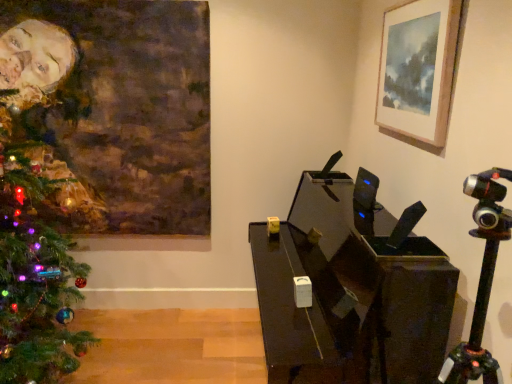
Question: Does green matte christmas tree at left contain wooden picture frame at upper right, the 2th picture frame positioned from the left?

Choices:
 (A) no
 (B) yes

Answer: (A)

Question: From the image's perspective, is green matte christmas tree at left beneath wooden picture frame at upper right, marked as the 1th picture frame in a front-to-back arrangement?

Choices:
 (A) yes
 (B) no

Answer: (A)

Question: Is green matte christmas tree at left thinner than wooden picture frame at upper right, the 2th picture frame positioned from the left?

Choices:
 (A) no
 (B) yes

Answer: (A)

Question: Can we say green matte christmas tree at left lies outside wooden picture frame at upper right, positioned as the first picture frame in right-to-left order?

Choices:
 (A) no
 (B) yes

Answer: (B)

Question: Can you confirm if green matte christmas tree at left is wider than wooden picture frame at upper right, positioned as the first picture frame in right-to-left order?

Choices:
 (A) yes
 (B) no

Answer: (A)

Question: Is green matte christmas tree at left smaller than wooden picture frame at upper right, marked as the 1th picture frame in a front-to-back arrangement?

Choices:
 (A) no
 (B) yes

Answer: (A)

Question: Does oil painting portrait at left, acting as the 1th picture frame starting from the left, turn towards green matte christmas tree at left?

Choices:
 (A) yes
 (B) no

Answer: (A)

Question: Are oil painting portrait at left, the first picture frame in the back-to-front sequence, and green matte christmas tree at left located far from each other?

Choices:
 (A) yes
 (B) no

Answer: (B)

Question: Does oil painting portrait at left, the 2th picture frame in the right-to-left sequence, have a larger size compared to green matte christmas tree at left?

Choices:
 (A) no
 (B) yes

Answer: (A)

Question: Can you confirm if oil painting portrait at left, acting as the 1th picture frame starting from the left, is wider than green matte christmas tree at left?

Choices:
 (A) yes
 (B) no

Answer: (B)

Question: Can you confirm if oil painting portrait at left, the 2th picture frame in the right-to-left sequence, is smaller than green matte christmas tree at left?

Choices:
 (A) yes
 (B) no

Answer: (A)

Question: Can you confirm if oil painting portrait at left, which appears as the second picture frame when viewed from the front, is thinner than green matte christmas tree at left?

Choices:
 (A) no
 (B) yes

Answer: (B)

Question: Is wooden picture frame at upper right, the 2th picture frame positioned from the left, to the left of oil painting portrait at left, which appears as the second picture frame when viewed from the front, from the viewer's perspective?

Choices:
 (A) no
 (B) yes

Answer: (A)